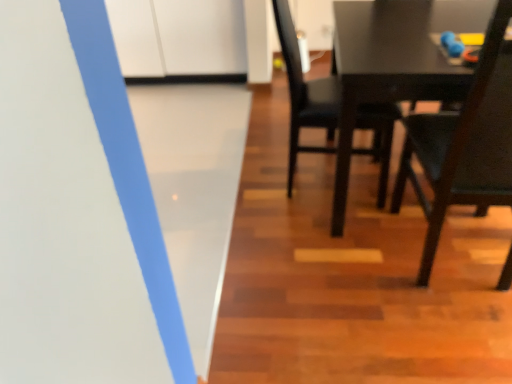
Question: Which is correct: dark wood chair at right, the first chair when ordered from right to left, is inside matte black chair at center, the second chair in the right-to-left sequence, or outside of it?

Choices:
 (A) outside
 (B) inside

Answer: (A)

Question: Is point (443, 119) positioned closer to the camera than point (311, 92)?

Choices:
 (A) closer
 (B) farther

Answer: (A)

Question: Is dark wood chair at right, the first chair when ordered from right to left, in front of or behind matte black chair at center, the second chair in the right-to-left sequence, in the image?

Choices:
 (A) front
 (B) behind

Answer: (A)

Question: From a real-world perspective, is matte black chair at center, marked as the first chair in a left-to-right arrangement, positioned above or below dark wood chair at right, the 2th chair viewed from the left?

Choices:
 (A) below
 (B) above

Answer: (A)

Question: Is matte black chair at center, the second chair in the right-to-left sequence, in front of or behind dark wood chair at right, the 2th chair viewed from the left, in the image?

Choices:
 (A) front
 (B) behind

Answer: (B)

Question: Is matte black chair at center, the second chair in the right-to-left sequence, to the left or to the right of dark wood chair at right, the 2th chair viewed from the left, in the image?

Choices:
 (A) left
 (B) right

Answer: (A)

Question: Based on their sizes in the image, would you say matte black chair at center, marked as the first chair in a left-to-right arrangement, is bigger or smaller than dark wood chair at right, the first chair when ordered from right to left?

Choices:
 (A) small
 (B) big

Answer: (A)